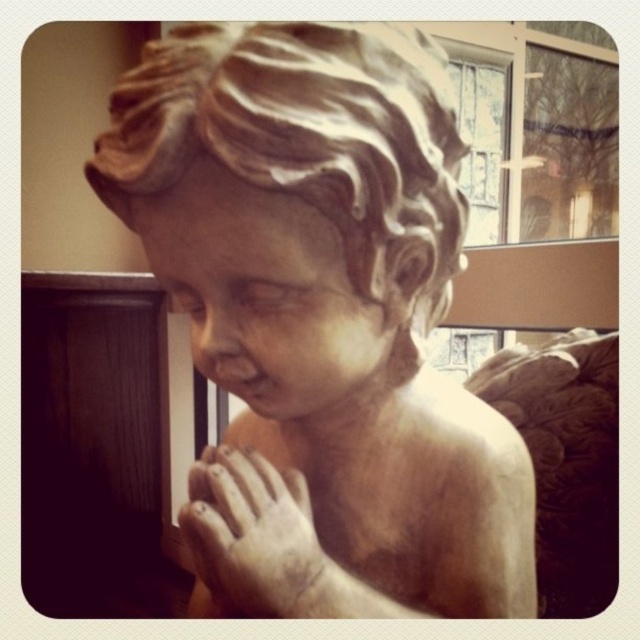
You are an art conservator examining the sculpture. You notice two parts of the statue, the matte white statue at center and the matte stone hand at center. Which part appears nearer to you?

The matte white statue at center is closer to the viewer than the matte stone hand at center, so the matte white statue at center appears nearer.

You are an art restorer working on the matte white statue at center and the matte stone hand at center. You need to place both items on a shelf that can only hold items up to the width of the wider object. Which object determines the maximum width the shelf must accommodate?

The matte white statue at center determines the maximum width the shelf must accommodate because its width surpasses that of the matte stone hand at center.